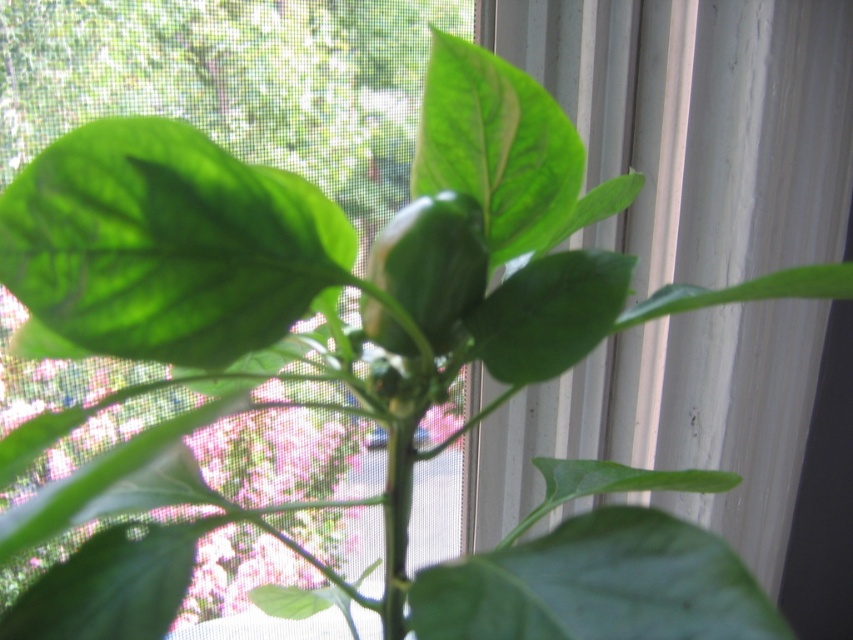
Question: Which point is closer to the camera taking this photo?

Choices:
 (A) (480, 182)
 (B) (141, 284)
 (C) (570, 545)
 (D) (598, 285)

Answer: (B)

Question: From the image, what is the correct spatial relationship of green matte leaf at upper left in relation to green smooth leaf at center?

Choices:
 (A) above
 (B) below

Answer: (A)

Question: Which object is closer to the camera taking this photo?

Choices:
 (A) green matte leaf at upper center
 (B) green matte leaf at upper left
 (C) green smooth leaf at center

Answer: (C)

Question: Considering the relative positions of green matte leaf at upper center and green matte leaf at center in the image provided, where is green matte leaf at upper center located with respect to green matte leaf at center?

Choices:
 (A) right
 (B) left

Answer: (B)

Question: From the image, what is the correct spatial relationship of green matte leaf at upper center in relation to green matte leaf at center?

Choices:
 (A) right
 (B) left

Answer: (B)

Question: Which of the following is the closest to the observer?

Choices:
 (A) (602, 280)
 (B) (515, 177)
 (C) (181, 182)
 (D) (590, 616)

Answer: (D)